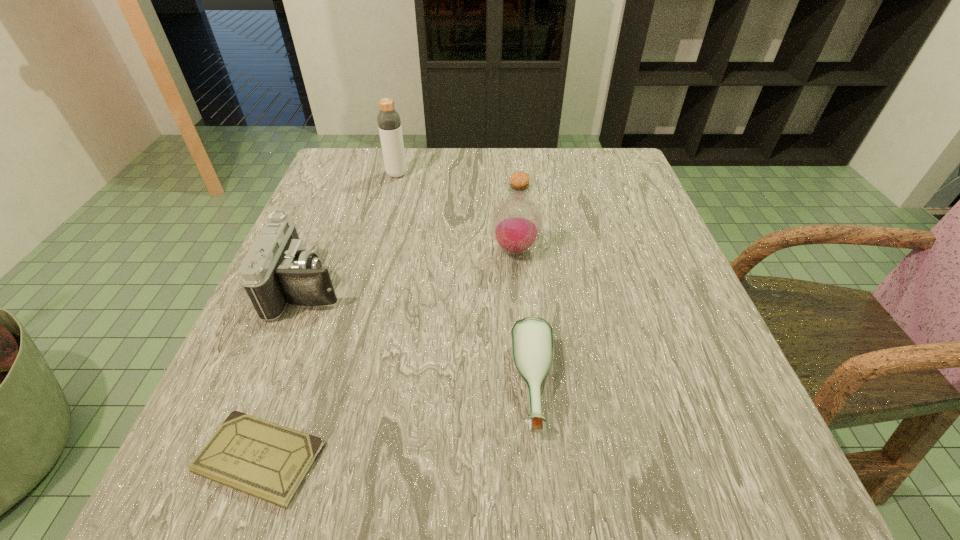
Identify the location of free space located on the back of the nearest bottle. (516, 202).

Image resolution: width=960 pixels, height=540 pixels. Identify the location of vacant area situated 0.240m on the right of the checkbook. (506, 458).

Find the location of a particular element. This screenshot has height=540, width=960. object located at the far edge is located at coordinates (389, 123).

In order to click on object at the near edge in this screenshot , I will do `click(268, 461)`.

In order to click on bottle present at the left edge in this screenshot , I will do `click(389, 123)`.

At what (x,y) coordinates should I click in order to perform the action: click on camera that is at the left edge. Please return your answer as a coordinate pair (x, y). Looking at the image, I should click on (278, 270).

This screenshot has height=540, width=960. In order to click on checkbook that is at the left edge in this screenshot , I will do `click(268, 461)`.

Where is `object that is at the far left corner`? The width and height of the screenshot is (960, 540). object that is at the far left corner is located at coordinates (389, 123).

Where is `object at the near left corner`? The height and width of the screenshot is (540, 960). object at the near left corner is located at coordinates (268, 461).

Locate an element on the screen. Image resolution: width=960 pixels, height=540 pixels. vacant space at the far edge of the desktop is located at coordinates (418, 151).